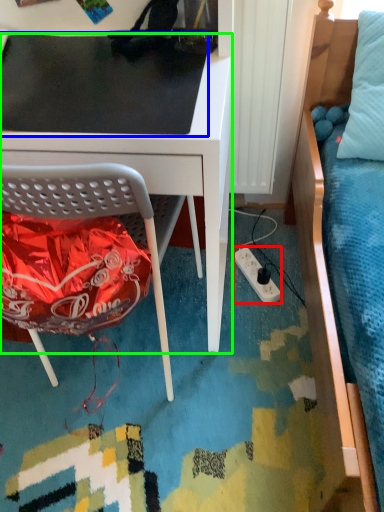
Question: Which object is positioned farthest from power outlet (highlighted by a red box)? Select from table top (highlighted by a blue box) and desk (highlighted by a green box).

Choices:
 (A) table top
 (B) desk

Answer: (A)